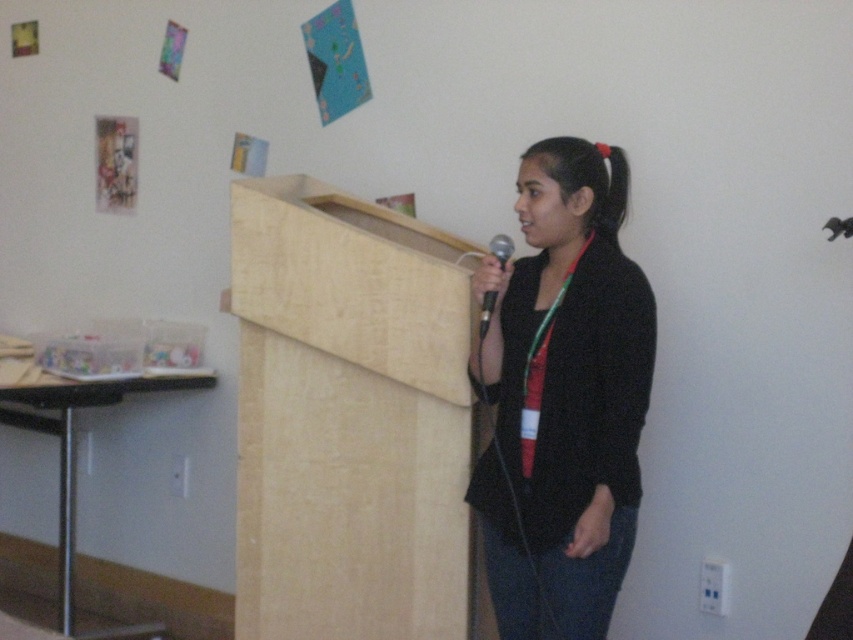
You are a photographer setting up for a presentation. The presenter is wearing a black matte jacket at center. To ensure the jacket is in the center of the photo, where should you position your camera relative to the jacket?

The black matte jacket at center is already positioned at the center of the image at point coordinates (563,397), so the camera should be aligned to capture the jacket at that central point to keep it centered in the photo.